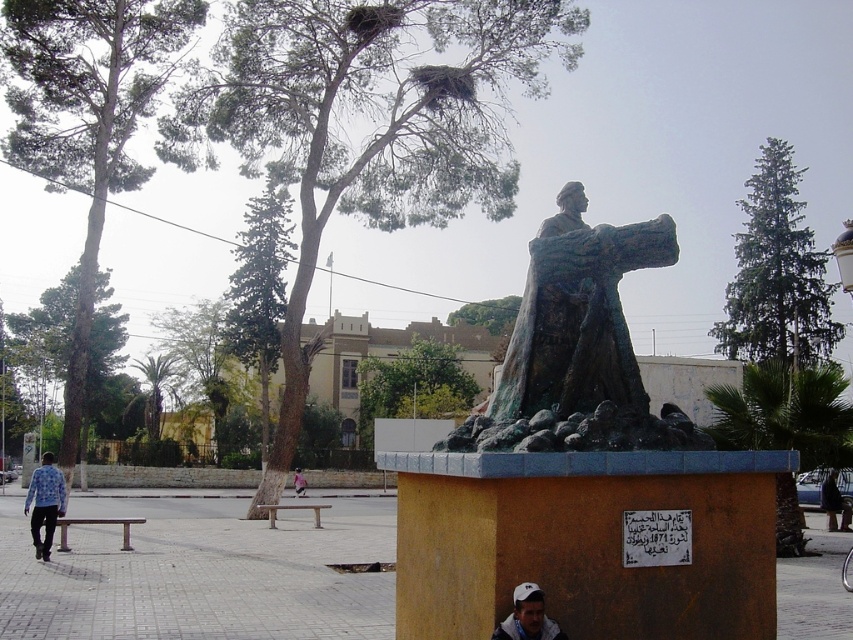
You are a photographer planning to take a picture of the statue and its pedestal. You notice the white cap at center and the dark blue jeans at lower right in your frame. Which object should you adjust your focus to ensure both are in the same focal plane, considering their height differences?

The white cap at center is shorter than the dark blue jeans at lower right. To ensure both are in focus, adjust the camera focus to the white cap at center since it is closer to the lens, or use a smaller aperture for a deeper depth of field.

You are standing in a public square and see the green patina bronze statue at center. If you want to touch the statue, how many steps do you think you need to take forward, assuming each step covers about 3 feet?

The green patina bronze statue at center is 18.31 feet away from the viewer. Since each step covers about 3 feet, you would need to take approximately 6 steps forward to reach it.

You are a photographer standing in the park and want to take a photo of the green patina bronze statue at center and the blue printed shirt at lower left. Which object should you focus on first if you want to capture both in the same frame without moving the camera?

The green patina bronze statue at center is above the blue printed shirt at lower left, so you should focus on the blue printed shirt at lower left first to ensure both are in the frame.